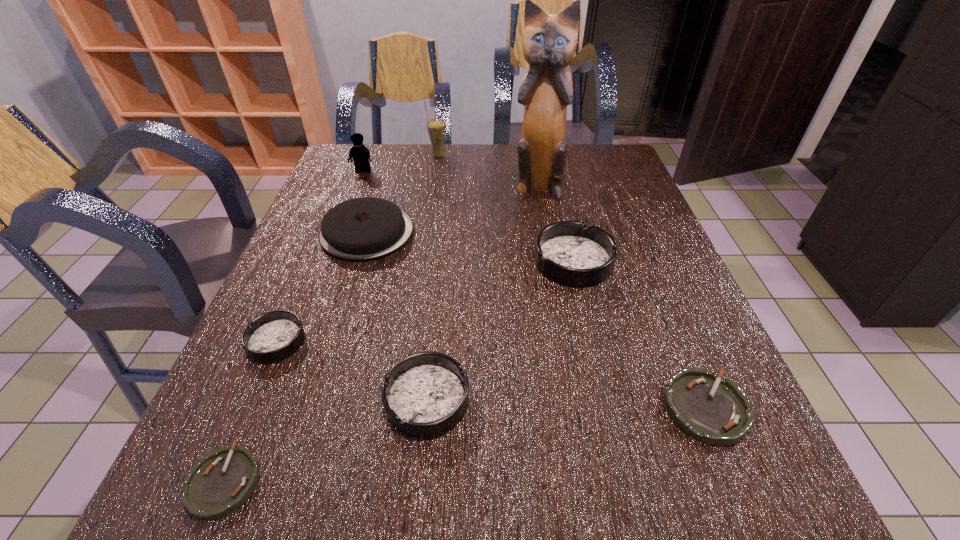
Image resolution: width=960 pixels, height=540 pixels. What are the coordinates of `pancake located in the left edge section of the desktop` in the screenshot? It's located at (361, 229).

At what (x,y) coordinates should I click in order to perform the action: click on object located at the far left corner. Please return your answer as a coordinate pair (x, y). The image size is (960, 540). Looking at the image, I should click on (361, 155).

Where is `object at the near left corner`? Image resolution: width=960 pixels, height=540 pixels. object at the near left corner is located at coordinates (220, 482).

The height and width of the screenshot is (540, 960). In the image, there is a desktop. What are the coordinates of `vacant space at the far edge` in the screenshot? It's located at tap(408, 161).

This screenshot has width=960, height=540. In the image, there is a desktop. Identify the location of vacant space at the near edge. (644, 510).

Find the location of a particular element. The image size is (960, 540). free spot at the left edge of the desktop is located at coordinates (338, 186).

Find the location of a particular element. vacant space at the right edge of the desktop is located at coordinates (701, 338).

The width and height of the screenshot is (960, 540). What are the coordinates of `vacant position at the far left corner of the desktop` in the screenshot? It's located at (374, 144).

Identify the location of vacant space at the near left corner of the desktop. (262, 491).

Find the location of a particular element. The width and height of the screenshot is (960, 540). empty space between the shortest object and the sixth farthest object is located at coordinates (251, 410).